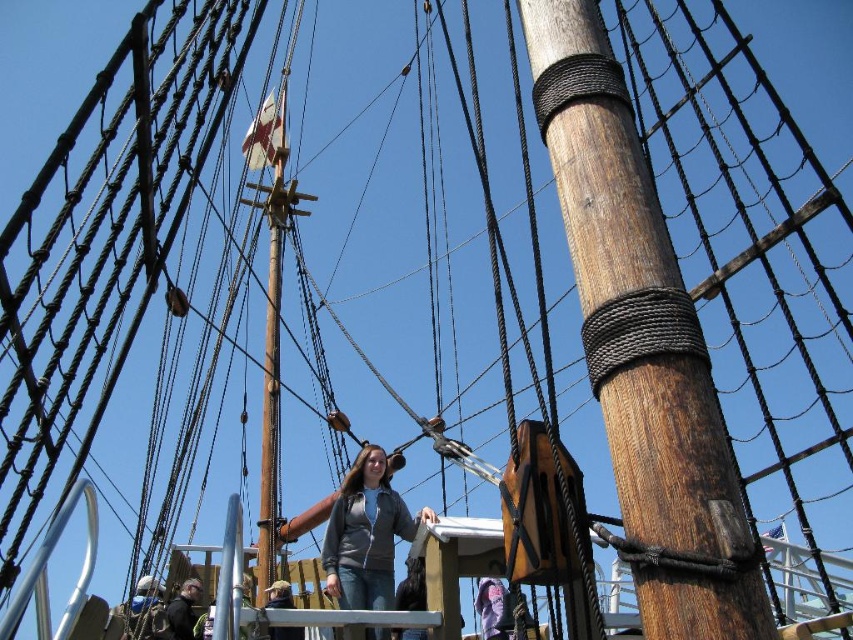
Does wooden pole at center appear under gray matte jacket at center?

Incorrect, wooden pole at center is not positioned below gray matte jacket at center.

Can you confirm if wooden pole at center is positioned to the right of gray matte jacket at center?

Correct, you'll find wooden pole at center to the right of gray matte jacket at center.

Who is more forward, (583, 145) or (347, 488)?

Point (583, 145) is more forward.

Locate an element on the screen. wooden pole at center is located at coordinates (642, 344).